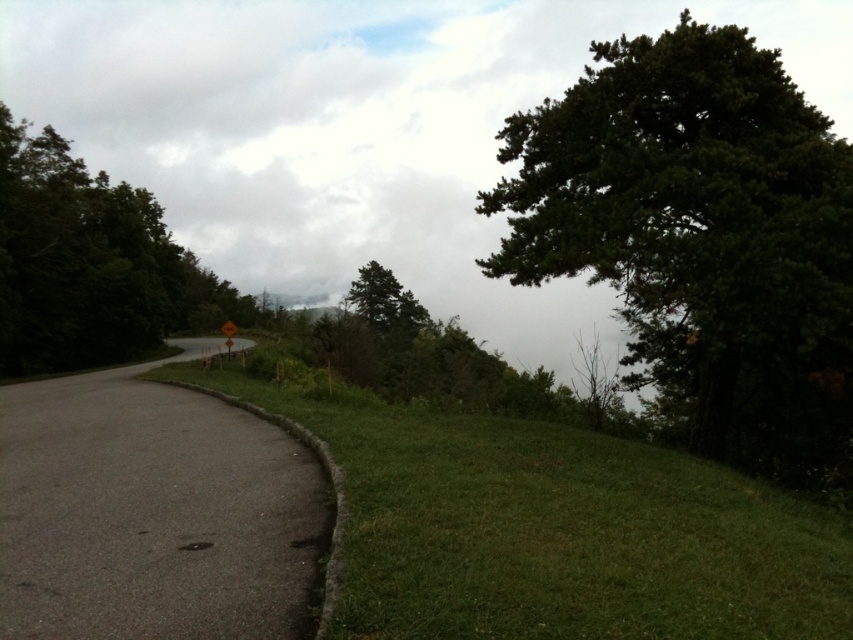
Question: Is green grassy at lower left smaller than gray asphalt road at left?

Choices:
 (A) no
 (B) yes

Answer: (B)

Question: In this image, where is green leafy tree at upper right located relative to green matte tree at center?

Choices:
 (A) right
 (B) left

Answer: (A)

Question: Is green leafy tree at left wider than yellow reflective plastic at center?

Choices:
 (A) yes
 (B) no

Answer: (B)

Question: Among these points, which one is nearest to the camera?

Choices:
 (A) (225, 328)
 (B) (397, 317)
 (C) (202, 452)

Answer: (C)

Question: Among these objects, which one is nearest to the camera?

Choices:
 (A) gray asphalt road at left
 (B) green leafy tree at upper right
 (C) yellow reflective plastic at center
 (D) green leafy tree at left

Answer: (A)

Question: Which of the following is the farthest from the observer?

Choices:
 (A) (21, 340)
 (B) (733, 429)
 (C) (248, 589)
 (D) (164, 365)

Answer: (D)